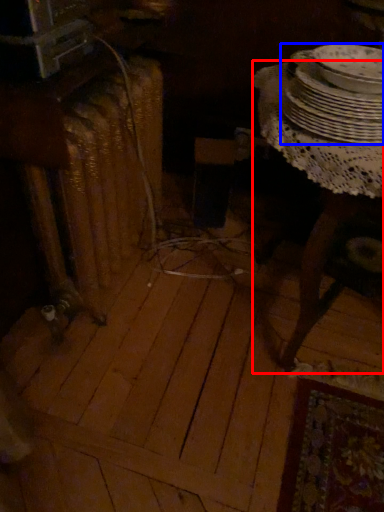
Question: Which object is further to the camera taking this photo, table (highlighted by a red box) or tableware (highlighted by a blue box)?

Choices:
 (A) table
 (B) tableware

Answer: (B)